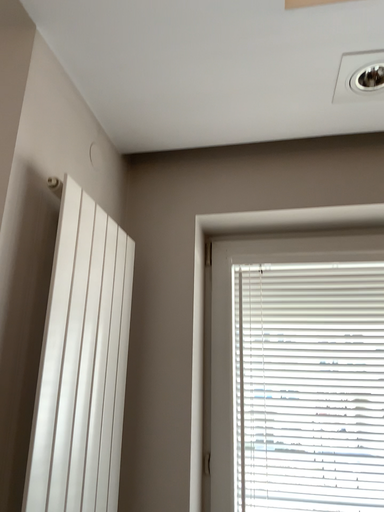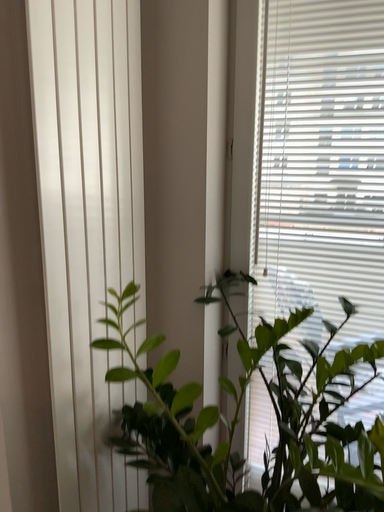
Question: Which way did the camera rotate in the video?

Choices:
 (A) rotated right
 (B) rotated left

Answer: (B)